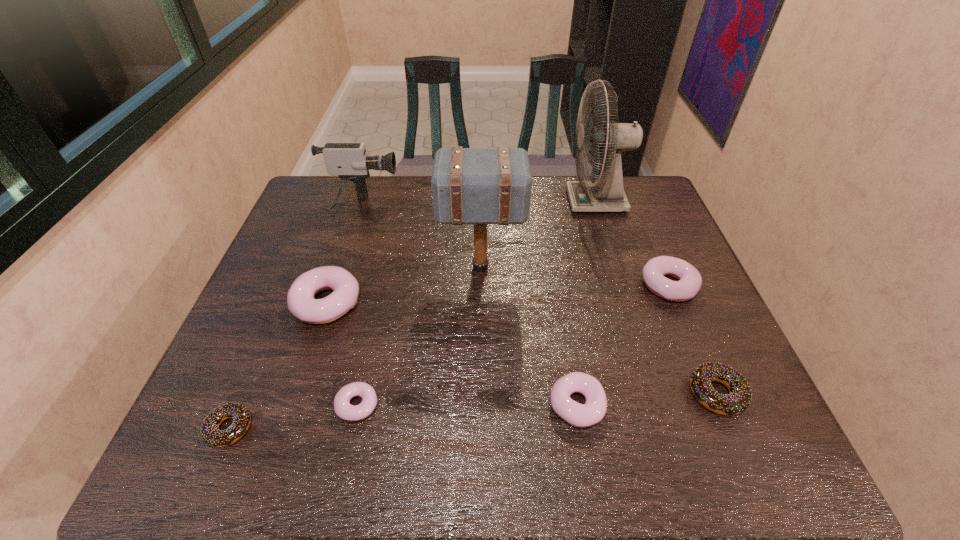
Image resolution: width=960 pixels, height=540 pixels. What are the coordinates of `doughnut that can be found as the fourth closest to the fan` in the screenshot? It's located at (301, 302).

Find the location of a particular element. The image size is (960, 540). doughnut that is the fifth closest to the smallest purple doughnut is located at coordinates (690, 281).

In order to click on purple doughnut identified as the fourth closest to the mallet in this screenshot , I will do `click(343, 409)`.

Identify which purple doughnut is located as the second nearest to the gray mallet. Please provide its 2D coordinates. Your answer should be formatted as a tuple, i.e. [(x, y)], where the tuple contains the x and y coordinates of a point satisfying the conditions above.

[(576, 414)]

Find the location of a particular element. The width and height of the screenshot is (960, 540). free spot that satisfies the following two spatial constraints: 1. on the back side of the bigger chocolate doughnut; 2. on the front-facing side of the fan is located at coordinates (636, 201).

Where is `free point that satisfies the following two spatial constraints: 1. on the front-facing side of the third smallest purple doughnut; 2. on the left side of the gray fan`? free point that satisfies the following two spatial constraints: 1. on the front-facing side of the third smallest purple doughnut; 2. on the left side of the gray fan is located at coordinates (623, 286).

What are the coordinates of `free space in the image that satisfies the following two spatial constraints: 1. on the back side of the right chocolate doughnut; 2. on the front-facing side of the fan` in the screenshot? It's located at (636, 201).